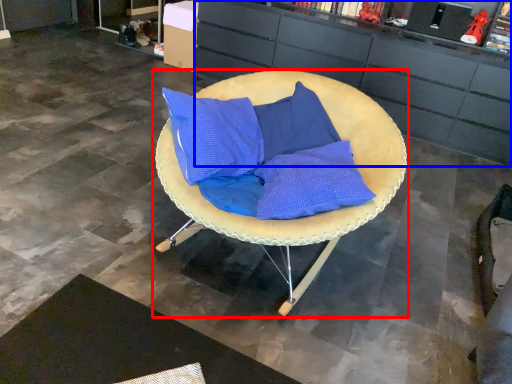
Question: Which point is further to the camera, chair (highlighted by a red box) or cabinetry (highlighted by a blue box)?

Choices:
 (A) chair
 (B) cabinetry

Answer: (B)